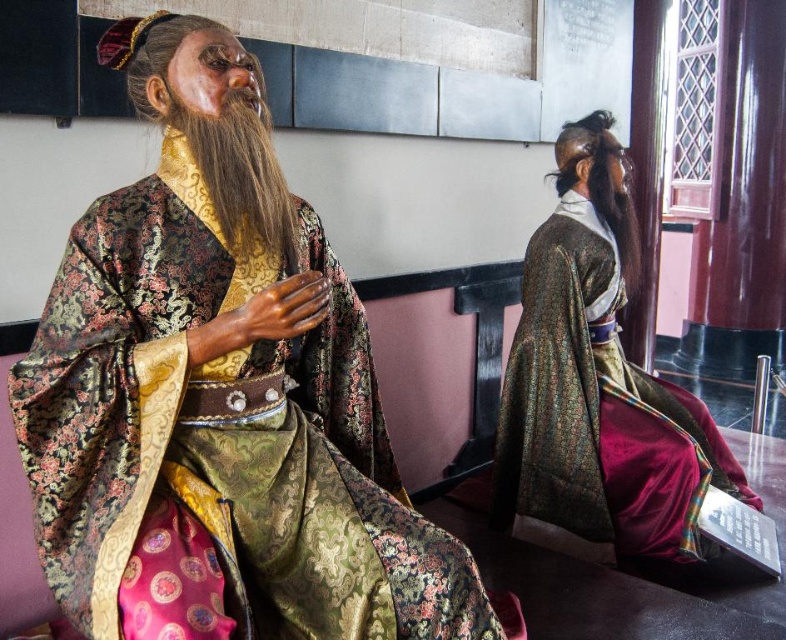
Question: Is gold brocade robe at center thinner than velvet-like green robe at right?

Choices:
 (A) no
 (B) yes

Answer: (B)

Question: Is gold brocade robe at center positioned in front of velvet-like green robe at right?

Choices:
 (A) no
 (B) yes

Answer: (B)

Question: Estimate the real-world distances between objects in this image. Which object is closer to the brown silky beard at center?

Choices:
 (A) velvet-like green robe at right
 (B) gold brocade robe at center

Answer: (B)

Question: Considering the real-world distances, which object is farthest from the gold brocade robe at center?

Choices:
 (A) velvet-like green robe at right
 (B) brown silky beard at center

Answer: (A)

Question: Is gold brocade robe at center closer to the viewer compared to brown silky beard at center?

Choices:
 (A) yes
 (B) no

Answer: (A)

Question: Based on their relative distances, which object is farther from the gold brocade robe at center?

Choices:
 (A) velvet-like green robe at right
 (B) brown silky beard at center

Answer: (A)